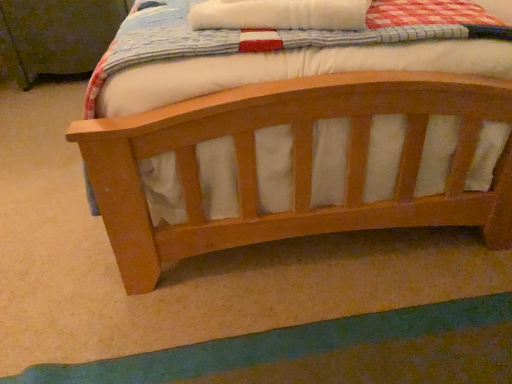
Where is `vacant space behind green fabric at lower center`? The image size is (512, 384). vacant space behind green fabric at lower center is located at coordinates (260, 278).